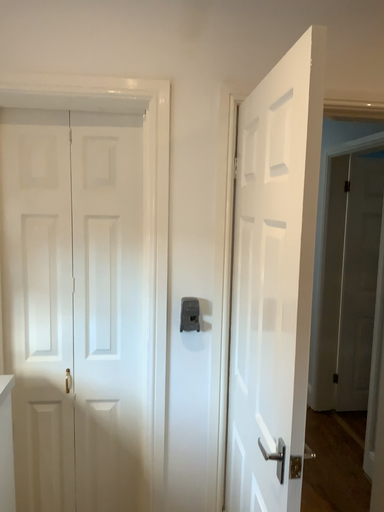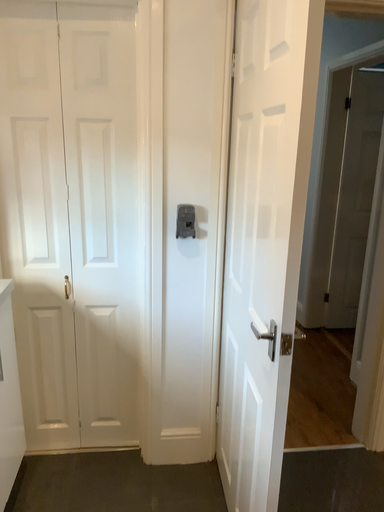
Question: Which way did the camera rotate in the video?

Choices:
 (A) rotated downward
 (B) rotated upward

Answer: (A)